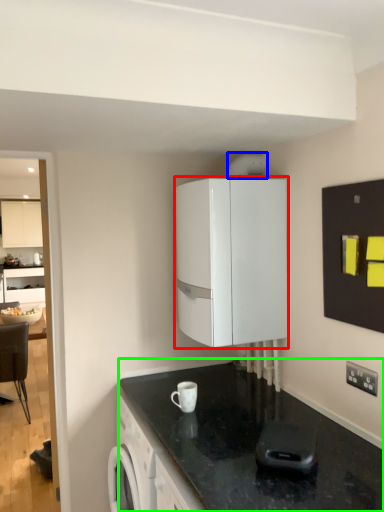
Question: Which object is the farthest from cabinetry (highlighted by a red box)? Choose among these: appliance (highlighted by a blue box) or countertop (highlighted by a green box).

Choices:
 (A) appliance
 (B) countertop

Answer: (B)